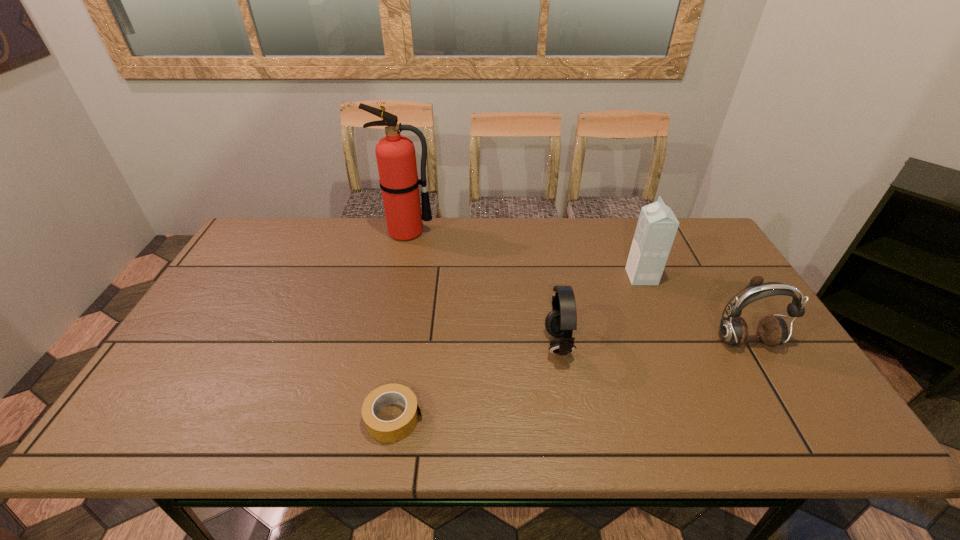
The height and width of the screenshot is (540, 960). I want to click on object that is positioned at the near edge, so click(x=384, y=431).

Locate an element on the screen. The width and height of the screenshot is (960, 540). object located in the right edge section of the desktop is located at coordinates (772, 330).

The image size is (960, 540). In the image, there is a desktop. Identify the location of vacant space at the far edge. (590, 249).

Identify the location of vacant region at the near edge of the desktop. The width and height of the screenshot is (960, 540). (431, 441).

In the image, there is a desktop. At what (x,y) coordinates should I click in order to perform the action: click on vacant space at the left edge. Please return your answer as a coordinate pair (x, y). The width and height of the screenshot is (960, 540). Looking at the image, I should click on (199, 322).

In the image, there is a desktop. Find the location of `vacant space at the right edge`. vacant space at the right edge is located at coordinates (732, 271).

This screenshot has width=960, height=540. In the image, there is a desktop. Identify the location of vacant space at the far left corner. (255, 253).

Image resolution: width=960 pixels, height=540 pixels. In the image, there is a desktop. In order to click on vacant space at the near left corner in this screenshot , I will do `click(173, 432)`.

Where is `vacant region at the near right corner of the desktop`? vacant region at the near right corner of the desktop is located at coordinates (776, 407).

The width and height of the screenshot is (960, 540). Find the location of `empty space that is in between the carton and the third tallest object`. empty space that is in between the carton and the third tallest object is located at coordinates (693, 309).